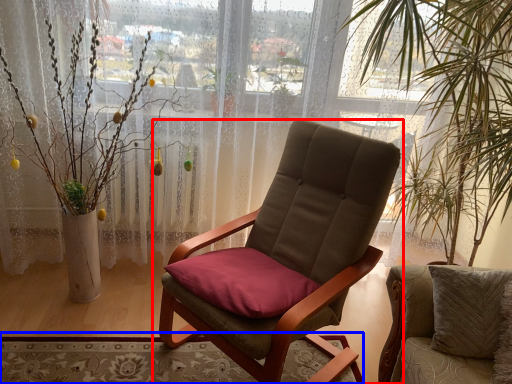
Question: Which object is further to the camera taking this photo, chair (highlighted by a red box) or mat (highlighted by a blue box)?

Choices:
 (A) chair
 (B) mat

Answer: (B)